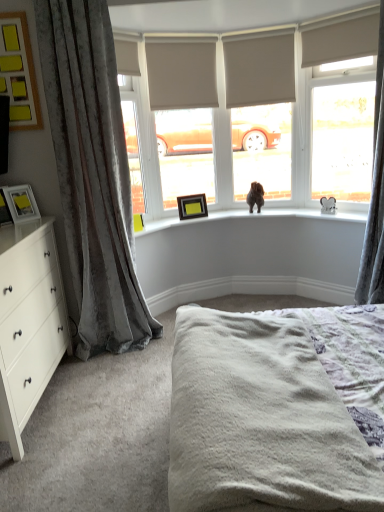
Question: From the image's perspective, is velvet gray curtain at right, which appears as the 1th curtain when viewed from the right, over beige fabric blind at upper right, positioned as the first blind in right-to-left order?

Choices:
 (A) yes
 (B) no

Answer: (B)

Question: Is velvet gray curtain at right, which appears as the 1th curtain when viewed from the right, shorter than beige fabric blind at upper right, positioned as the first blind in right-to-left order?

Choices:
 (A) no
 (B) yes

Answer: (A)

Question: Is velvet gray curtain at right, which appears as the 1th curtain when viewed from the right, wider than beige fabric blind at upper right, positioned as the first blind in right-to-left order?

Choices:
 (A) yes
 (B) no

Answer: (A)

Question: Is velvet gray curtain at right, which is the 2th curtain from left to right, facing towards beige fabric blind at upper right, placed as the third blind when sorted from left to right?

Choices:
 (A) yes
 (B) no

Answer: (B)

Question: Is velvet gray curtain at right, which appears as the 1th curtain when viewed from the right, completely or partially outside of beige fabric blind at upper right, placed as the third blind when sorted from left to right?

Choices:
 (A) yes
 (B) no

Answer: (A)

Question: Is velvet gray curtain at right, which appears as the 1th curtain when viewed from the right, positioned behind beige fabric blind at upper right, placed as the third blind when sorted from left to right?

Choices:
 (A) no
 (B) yes

Answer: (A)

Question: Considering the relative sizes of beige fabric blind at upper center, which appears as the second blind when viewed from the left, and matte black picture frame at left, which is the third picture frame in right-to-left order, in the image provided, is beige fabric blind at upper center, which appears as the second blind when viewed from the left, wider than matte black picture frame at left, which is the third picture frame in right-to-left order,?

Choices:
 (A) yes
 (B) no

Answer: (B)

Question: Can you confirm if beige fabric blind at upper center, which appears as the second blind when viewed from the left, is taller than matte black picture frame at left, which is the third picture frame in right-to-left order?

Choices:
 (A) yes
 (B) no

Answer: (A)

Question: Does beige fabric blind at upper center, which appears as the second blind when viewed from the left, lie behind matte black picture frame at left, the second picture frame in the bottom-to-top sequence?

Choices:
 (A) no
 (B) yes

Answer: (B)

Question: Is beige fabric blind at upper center, which appears as the second blind when viewed from the right, not close to matte black picture frame at left, positioned as the 3th picture frame in top-to-bottom order?

Choices:
 (A) no
 (B) yes

Answer: (B)

Question: Is beige fabric blind at upper center, which appears as the second blind when viewed from the right, thinner than matte black picture frame at left, the third picture frame in the front-to-back sequence?

Choices:
 (A) no
 (B) yes

Answer: (B)

Question: From the image's perspective, is beige fabric blind at upper center, which appears as the second blind when viewed from the left, above matte black picture frame at left, positioned as the 3th picture frame in top-to-bottom order?

Choices:
 (A) no
 (B) yes

Answer: (B)

Question: Is matte black picture frame at left, which is counted as the 4th picture frame, starting from the right, positioned with its back to velvet gray curtain at left, the 1th curtain viewed from the left?

Choices:
 (A) no
 (B) yes

Answer: (A)